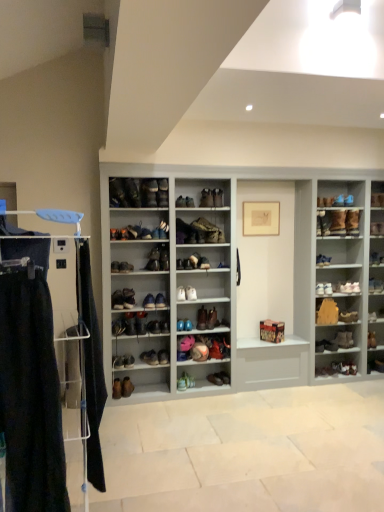
Question: Is leather boot at center, the 8th shoe when ordered from right to left, oriented away from leather shoe at center, marked as the second shoe in a left-to-right arrangement?

Choices:
 (A) yes
 (B) no

Answer: (B)

Question: Considering the relative sizes of leather boot at center, the 8th shoe when ordered from right to left, and leather shoe at center, which is the 24th shoe from right to left, in the image provided, is leather boot at center, the 8th shoe when ordered from right to left, wider than leather shoe at center, which is the 24th shoe from right to left,?

Choices:
 (A) no
 (B) yes

Answer: (A)

Question: Is leather boot at center, the 8th shoe when ordered from right to left, further to the viewer compared to leather shoe at center, marked as the second shoe in a left-to-right arrangement?

Choices:
 (A) yes
 (B) no

Answer: (A)

Question: Is leather boot at center, the 8th shoe when ordered from right to left, in front of leather shoe at center, marked as the second shoe in a left-to-right arrangement?

Choices:
 (A) no
 (B) yes

Answer: (A)

Question: Is leather boot at center, the 8th shoe when ordered from right to left, in contact with leather shoe at center, marked as the second shoe in a left-to-right arrangement?

Choices:
 (A) no
 (B) yes

Answer: (A)

Question: Considering the relative sizes of leather boot at center, acting as the eighteenth shoe starting from the left, and leather shoe at center, marked as the second shoe in a left-to-right arrangement, in the image provided, is leather boot at center, acting as the eighteenth shoe starting from the left, taller than leather shoe at center, marked as the second shoe in a left-to-right arrangement,?

Choices:
 (A) no
 (B) yes

Answer: (B)

Question: From the image's perspective, is leather boot at center, marked as the twentieth shoe in a right-to-left arrangement, under shiny blue shoe at center right, marked as the twentieth shoe in a left-to-right arrangement?

Choices:
 (A) yes
 (B) no

Answer: (B)

Question: Does leather boot at center, which ranks as the 6th shoe in left-to-right order, have a larger size compared to shiny blue shoe at center right, marked as the twentieth shoe in a left-to-right arrangement?

Choices:
 (A) yes
 (B) no

Answer: (A)

Question: From a real-world perspective, is leather boot at center, which ranks as the 6th shoe in left-to-right order, positioned over shiny blue shoe at center right, marked as the twentieth shoe in a left-to-right arrangement, based on gravity?

Choices:
 (A) yes
 (B) no

Answer: (A)

Question: Does leather boot at center, which ranks as the 6th shoe in left-to-right order, have a greater height compared to shiny blue shoe at center right, positioned as the sixth shoe in right-to-left order?

Choices:
 (A) yes
 (B) no

Answer: (A)

Question: Is leather boot at center, which ranks as the 6th shoe in left-to-right order, positioned before shiny blue shoe at center right, positioned as the sixth shoe in right-to-left order?

Choices:
 (A) yes
 (B) no

Answer: (A)

Question: From the image's perspective, is leather boot at center, marked as the twentieth shoe in a right-to-left arrangement, on shiny blue shoe at center right, positioned as the sixth shoe in right-to-left order?

Choices:
 (A) yes
 (B) no

Answer: (A)

Question: Can you confirm if shiny blue shoe at center right, marked as the twentieth shoe in a left-to-right arrangement, is bigger than dark blue fabric at left?

Choices:
 (A) no
 (B) yes

Answer: (A)